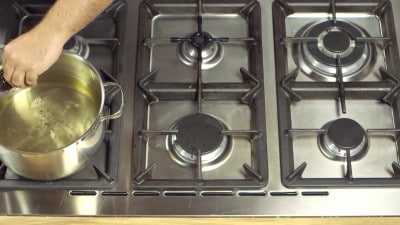
Find the location of a particular element. This screenshot has height=225, width=400. burner is located at coordinates (210, 147), (75, 43), (193, 36), (330, 45), (346, 131).